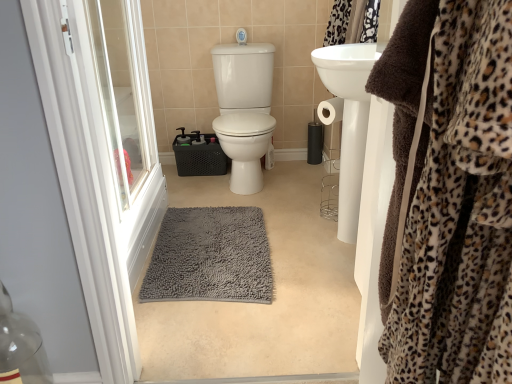
Find the location of `spots to the right of gray shaggy bath mat at center`. spots to the right of gray shaggy bath mat at center is located at coordinates (305, 251).